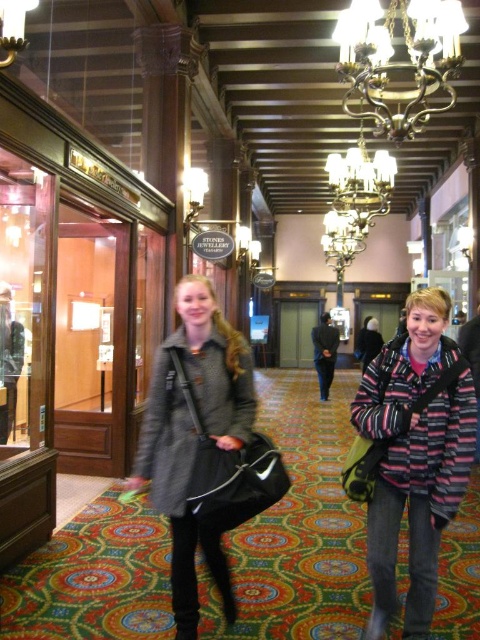
You are a customer in a store and see the gray wool coat at center and the bronze metallic chandelier at upper center. Which object is taller?

The gray wool coat at center is taller than the bronze metallic chandelier at upper center.

You are a customer browsing the items in the hallway. You see the striped woolen sweater at center and the gray wool coat at center. Which one is shorter?

The striped woolen sweater at center is shorter than the gray wool coat at center.